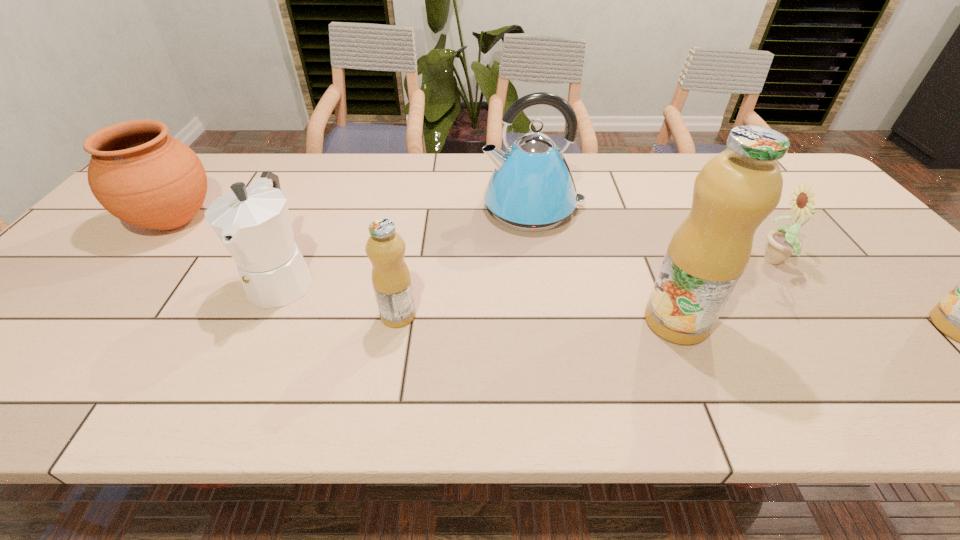
Where is `the second closest object to the second shortest fruit juice`? the second closest object to the second shortest fruit juice is located at coordinates (736, 190).

Select which object appears as the fifth closest to the shortest fruit juice. Please provide its 2D coordinates. Your answer should be formatted as a tuple, i.e. [(x, y)], where the tuple contains the x and y coordinates of a point satisfying the conditions above.

[(783, 242)]

The width and height of the screenshot is (960, 540). I want to click on the closest fruit juice to the fifth object from right to left, so click(736, 190).

Locate which fruit juice ranks second in proximity to the rightmost fruit juice. Please provide its 2D coordinates. Your answer should be formatted as a tuple, i.e. [(x, y)], where the tuple contains the x and y coordinates of a point satisfying the conditions above.

[(385, 248)]

Locate an element on the screen. This screenshot has width=960, height=540. blank space that satisfies the following two spatial constraints: 1. on the front-facing side of the sixth object from left to right; 2. at the spout of the second object from left to right is located at coordinates (788, 278).